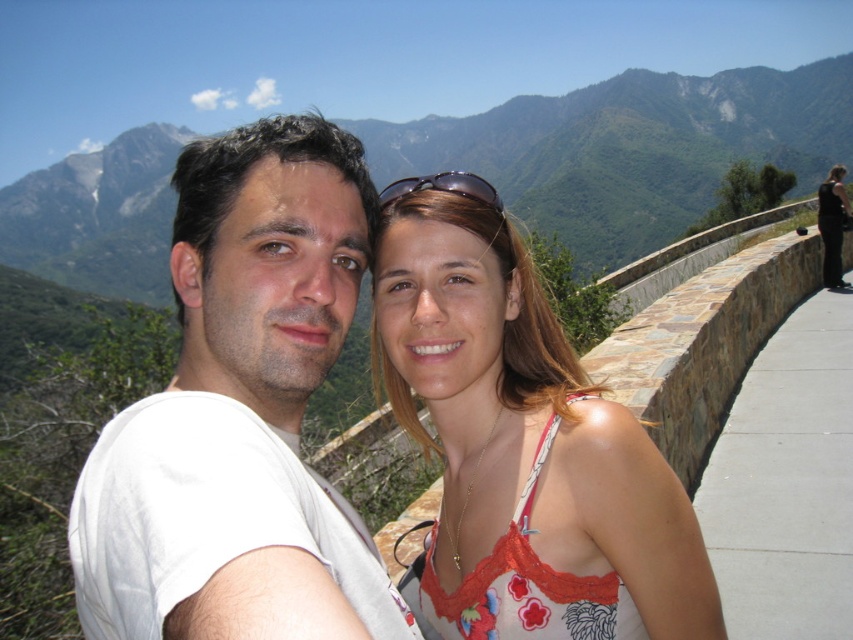
Question: Is white cotton t-shirt at center further to the viewer compared to floral lace tank top at center?

Choices:
 (A) yes
 (B) no

Answer: (B)

Question: Among these objects, which one is nearest to the camera?

Choices:
 (A) black satin dress at right
 (B) white cotton t-shirt at center

Answer: (B)

Question: Among these points, which one is farthest from the camera?

Choices:
 (A) (830, 180)
 (B) (100, 154)

Answer: (B)

Question: Is the position of white cotton t-shirt at center more distant than that of floral lace tank top at center?

Choices:
 (A) no
 (B) yes

Answer: (A)

Question: Among these objects, which one is farthest from the camera?

Choices:
 (A) sunglasses at center
 (B) floral lace tank top at center
 (C) green grassy mountain at upper center
 (D) white cotton t-shirt at center

Answer: (C)

Question: Is white cotton t-shirt at center wider than green grassy mountain at upper center?

Choices:
 (A) yes
 (B) no

Answer: (B)